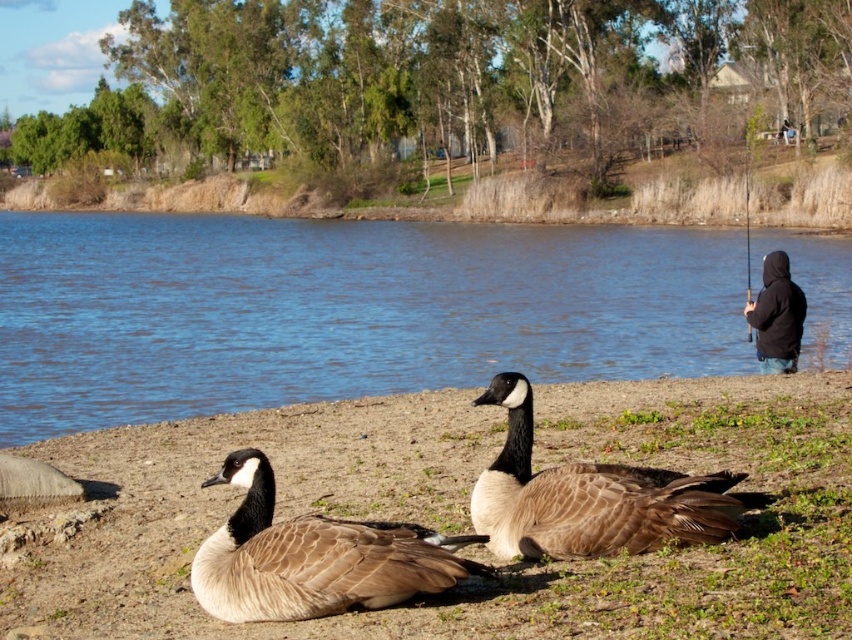
Question: Does brown feathered geese at center have a greater width compared to brown matte duck at lower center?

Choices:
 (A) yes
 (B) no

Answer: (A)

Question: Among these points, which one is farthest from the camera?

Choices:
 (A) (801, 472)
 (B) (678, 492)

Answer: (A)

Question: Which object is positioned farthest from the brown feathered goose at center?

Choices:
 (A) black hoodie at right
 (B) blue water at center

Answer: (B)

Question: Can you confirm if blue water at center is wider than brown feathered geese at center?

Choices:
 (A) no
 (B) yes

Answer: (B)

Question: Is brown matte duck at lower center above brown feathered goose at center?

Choices:
 (A) no
 (B) yes

Answer: (A)

Question: Which object is the farthest from the brown feathered goose at center?

Choices:
 (A) blue water at center
 (B) black hoodie at right
 (C) brown feathered geese at center
 (D) brown matte duck at lower center

Answer: (A)